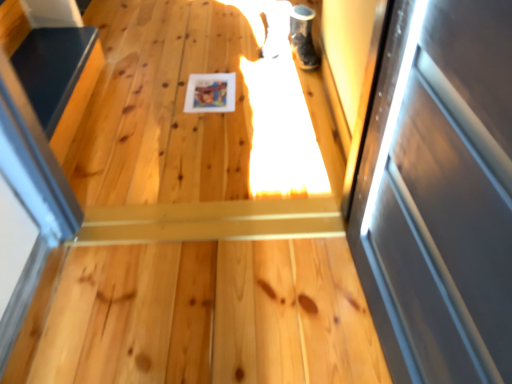
Question: Is shiny black shoe at upper right to the left of smooth black surface at left from the viewer's perspective?

Choices:
 (A) yes
 (B) no

Answer: (B)

Question: Is shiny black shoe at upper right outside smooth black surface at left?

Choices:
 (A) yes
 (B) no

Answer: (A)

Question: Does shiny black shoe at upper right contain smooth black surface at left?

Choices:
 (A) no
 (B) yes

Answer: (A)

Question: From a real-world perspective, does shiny black shoe at upper right stand above smooth black surface at left?

Choices:
 (A) yes
 (B) no

Answer: (A)

Question: Can you confirm if shiny black shoe at upper right is thinner than smooth black surface at left?

Choices:
 (A) yes
 (B) no

Answer: (A)

Question: Are shiny black shoe at upper right and smooth black surface at left located far from each other?

Choices:
 (A) yes
 (B) no

Answer: (A)

Question: Does smooth black surface at left turn towards shiny black shoe at upper right?

Choices:
 (A) yes
 (B) no

Answer: (A)

Question: From the image's perspective, is smooth black surface at left below shiny black shoe at upper right?

Choices:
 (A) no
 (B) yes

Answer: (B)

Question: Considering the relative sizes of smooth black surface at left and shiny black shoe at upper right in the image provided, is smooth black surface at left shorter than shiny black shoe at upper right?

Choices:
 (A) yes
 (B) no

Answer: (A)

Question: Is smooth black surface at left completely or partially outside of shiny black shoe at upper right?

Choices:
 (A) no
 (B) yes

Answer: (B)

Question: Is smooth black surface at left taller than shiny black shoe at upper right?

Choices:
 (A) yes
 (B) no

Answer: (B)

Question: Does smooth black surface at left appear on the right side of shiny black shoe at upper right?

Choices:
 (A) no
 (B) yes

Answer: (A)

Question: Visually, is shiny black shoe at upper right positioned to the left or to the right of smooth black surface at left?

Choices:
 (A) left
 (B) right

Answer: (B)